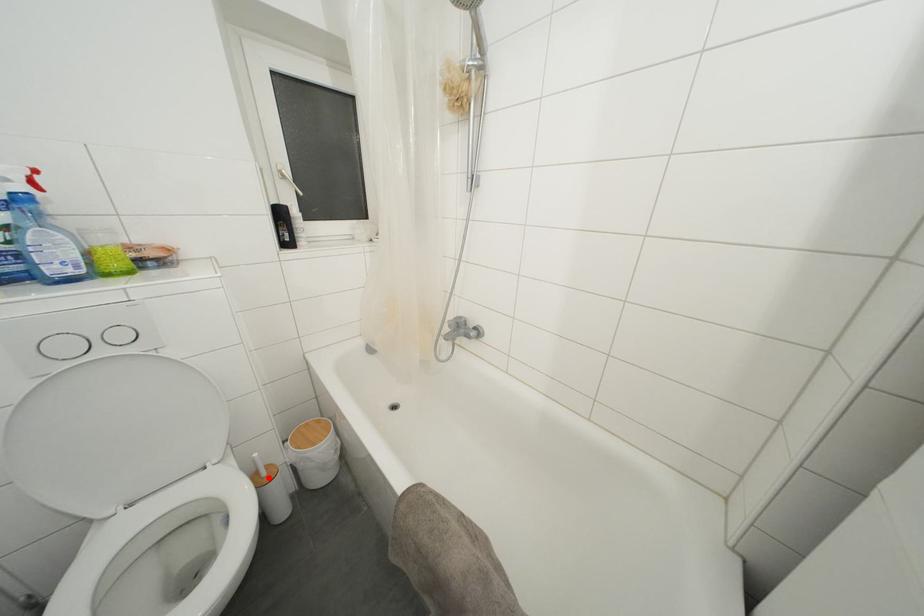
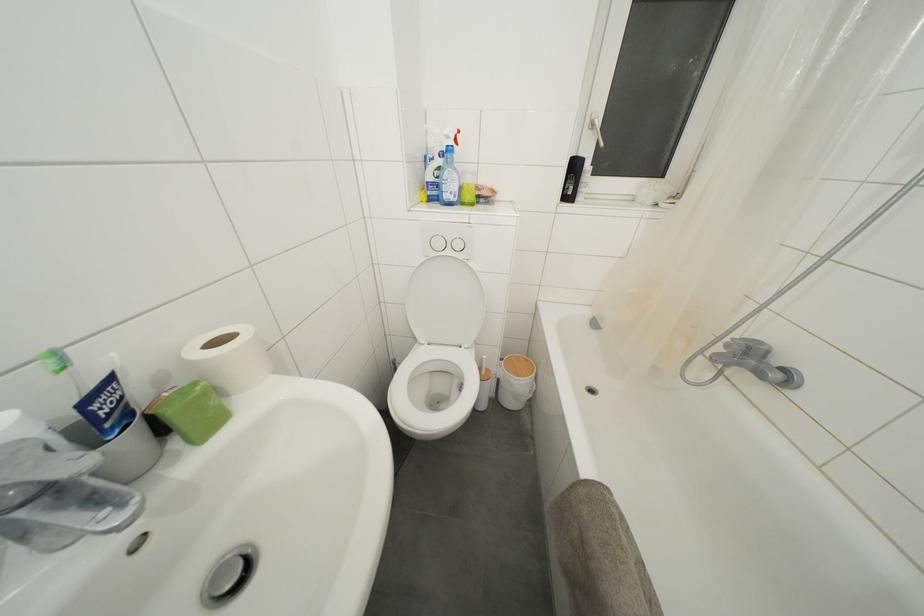
Question: I am providing you with two images of the same scene from different viewpoints. Given a red point in image1, look at the same physical point in image2. Is it:

Choices:
 (A) Closer to the viewpoint
 (B) Farther from the viewpoint

Answer: (B)